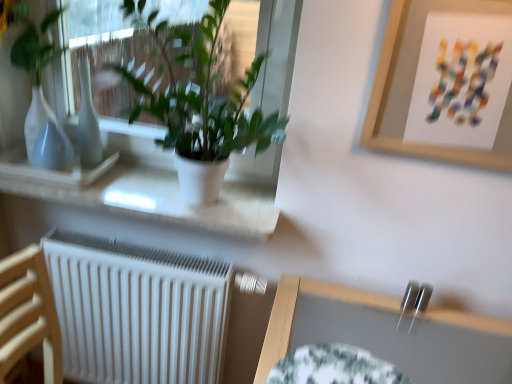
Identify the location of unoccupied region to the right of matte white vase at left, the 1th vase in the left-to-right sequence. (109, 181).